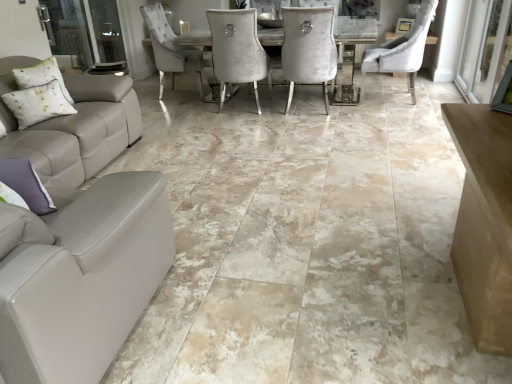
Question: From a real-world perspective, is white textured pillow at left, the second pillow viewed from the front, positioned above or below transparent glass screen door at right, placed as the 1th screen door when sorted from right to left?

Choices:
 (A) above
 (B) below

Answer: (A)

Question: Does point (71, 105) appear closer or farther from the camera than point (501, 69)?

Choices:
 (A) farther
 (B) closer

Answer: (B)

Question: Which object is the closest to the velvet white chair at center, arranged as the second chair when viewed from the right?

Choices:
 (A) velvet beige chair at center, the first chair when ordered from right to left
 (B) clear glass screen door at left, acting as the 1th screen door starting from the left
 (C) transparent glass screen door at right, placed as the 1th screen door when sorted from right to left
 (D) white textured pillow at left, positioned as the 1th pillow in left-to-right order
 (E) purple fabric pillow at lower left, which is counted as the second pillow, starting from the top

Answer: (A)

Question: Which of these objects is positioned farthest from the velvet white chair at center, arranged as the second chair when viewed from the right?

Choices:
 (A) transparent glass screen door at right, acting as the 2th screen door starting from the left
 (B) purple fabric pillow at lower left, which is counted as the second pillow, starting from the top
 (C) velvet beige chair at center, acting as the 2th chair starting from the left
 (D) clear glass screen door at left, which appears as the second screen door when viewed from the right
 (E) white textured pillow at left, positioned as the 1th pillow in left-to-right order

Answer: (B)